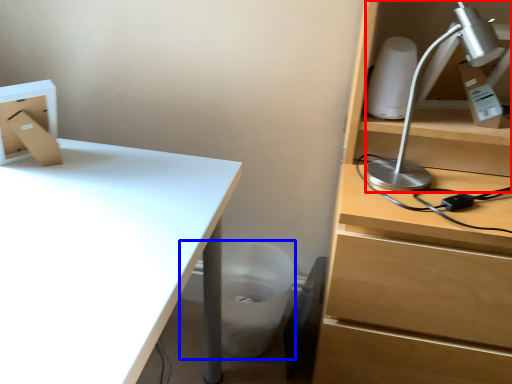
Question: Which object appears farthest to the camera in this image, lamp (highlighted by a red box) or trash bin/can (highlighted by a blue box)?

Choices:
 (A) lamp
 (B) trash bin/can

Answer: (B)